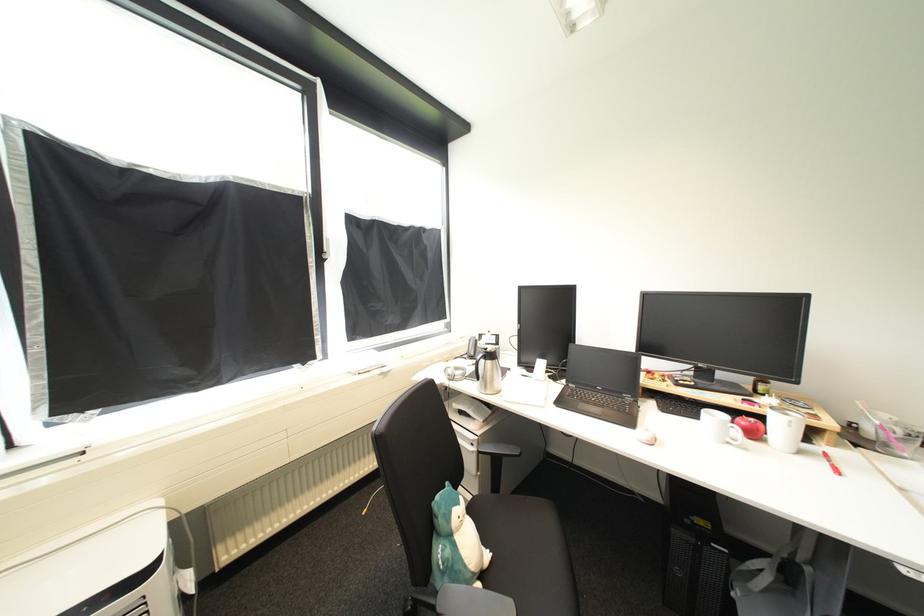
This screenshot has width=924, height=616. Find the location of `chair armrest`. chair armrest is located at coordinates (500, 450).